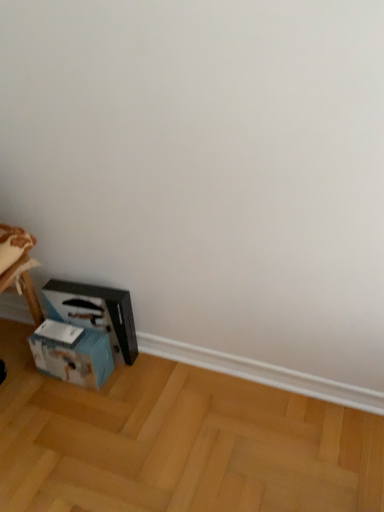
Question: Is black plastic workbench at lower left to the right of light brown wooden floor at lower left from the viewer's perspective?

Choices:
 (A) yes
 (B) no

Answer: (B)

Question: Is black plastic workbench at lower left positioned with its back to light brown wooden floor at lower left?

Choices:
 (A) no
 (B) yes

Answer: (A)

Question: From a real-world perspective, is black plastic workbench at lower left on top of light brown wooden floor at lower left?

Choices:
 (A) yes
 (B) no

Answer: (A)

Question: From a real-world perspective, is black plastic workbench at lower left under light brown wooden floor at lower left?

Choices:
 (A) no
 (B) yes

Answer: (A)

Question: Does black plastic workbench at lower left have a larger size compared to light brown wooden floor at lower left?

Choices:
 (A) no
 (B) yes

Answer: (A)

Question: Considering the relative sizes of black plastic workbench at lower left and light brown wooden floor at lower left in the image provided, is black plastic workbench at lower left wider than light brown wooden floor at lower left?

Choices:
 (A) yes
 (B) no

Answer: (B)

Question: Considering the relative sizes of light brown wooden floor at lower left and blue cardboard box at lower left in the image provided, is light brown wooden floor at lower left shorter than blue cardboard box at lower left?

Choices:
 (A) yes
 (B) no

Answer: (A)

Question: Could you tell me if light brown wooden floor at lower left is turned towards blue cardboard box at lower left?

Choices:
 (A) no
 (B) yes

Answer: (A)

Question: Considering the relative sizes of light brown wooden floor at lower left and blue cardboard box at lower left in the image provided, is light brown wooden floor at lower left wider than blue cardboard box at lower left?

Choices:
 (A) no
 (B) yes

Answer: (B)

Question: Are light brown wooden floor at lower left and blue cardboard box at lower left making contact?

Choices:
 (A) no
 (B) yes

Answer: (A)

Question: Is light brown wooden floor at lower left thinner than blue cardboard box at lower left?

Choices:
 (A) no
 (B) yes

Answer: (A)

Question: Is light brown wooden floor at lower left positioned beyond the bounds of blue cardboard box at lower left?

Choices:
 (A) yes
 (B) no

Answer: (A)

Question: Is blue cardboard box at lower left surrounded by black plastic workbench at lower left?

Choices:
 (A) yes
 (B) no

Answer: (B)